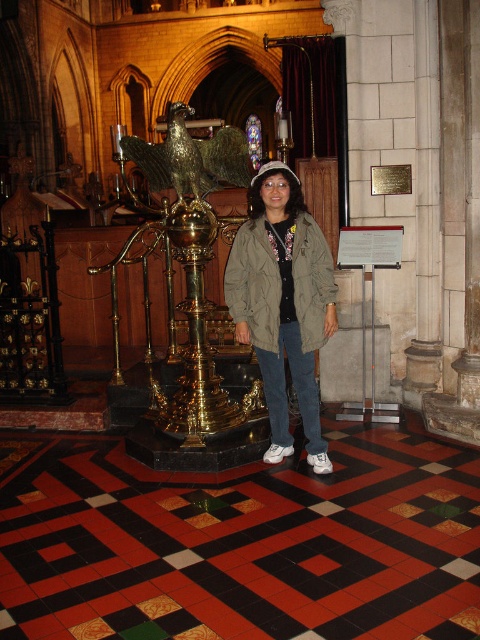
Question: Does olive green fabric trench coat at center appear over gold polished eagle at center?

Choices:
 (A) no
 (B) yes

Answer: (A)

Question: Which of the following is the closest to the observer?

Choices:
 (A) (334, 307)
 (B) (157, 160)
 (C) (312, 296)

Answer: (A)

Question: Which of the following is the closest to the observer?

Choices:
 (A) (213, 186)
 (B) (300, 300)
 (C) (313, 433)

Answer: (B)

Question: Which object is the farthest from the olive green fabric trench coat at center?

Choices:
 (A) gold polished eagle at center
 (B) khaki fabric jacket at center

Answer: (A)

Question: Observing the image, what is the correct spatial positioning of khaki fabric jacket at center in reference to gold polished eagle at center?

Choices:
 (A) above
 (B) below

Answer: (B)

Question: Is khaki fabric jacket at center thinner than gold polished eagle at center?

Choices:
 (A) no
 (B) yes

Answer: (B)